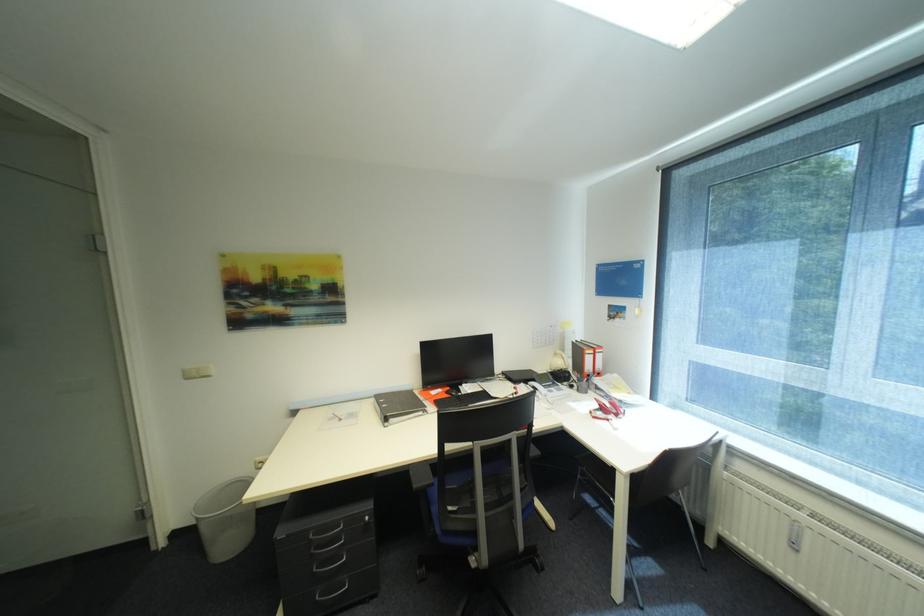
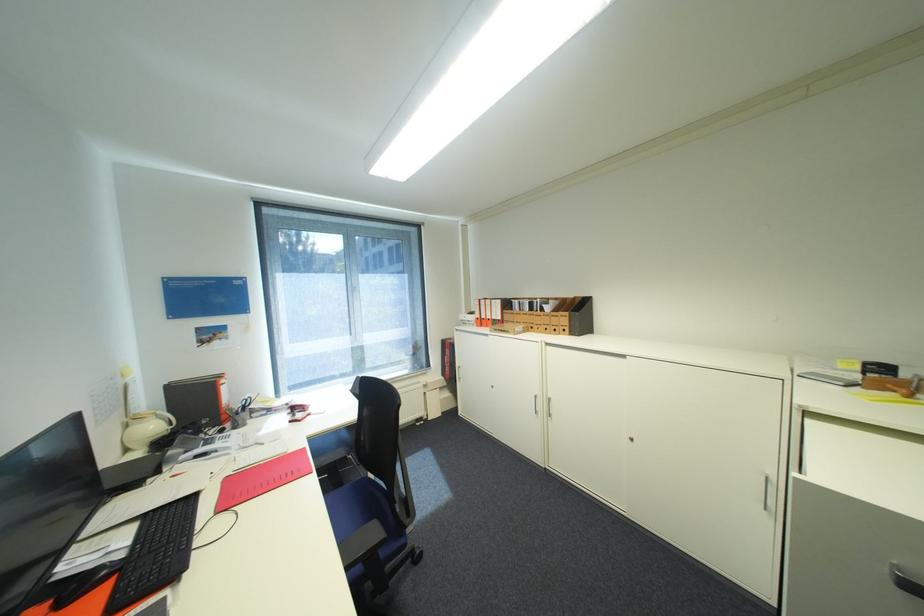
In the second image, find the point that corresponds to (567,363) in the first image.

(161, 427)